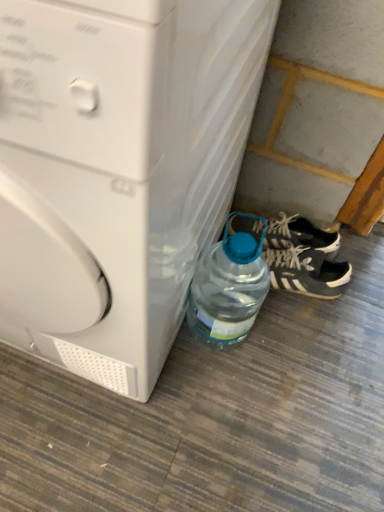
Question: From the image's perspective, is transparent plastic bottle at lower right located above white plastic washing machine at lower left?

Choices:
 (A) no
 (B) yes

Answer: (A)

Question: Is transparent plastic bottle at lower right to the left of white plastic washing machine at lower left from the viewer's perspective?

Choices:
 (A) no
 (B) yes

Answer: (A)

Question: Can you confirm if transparent plastic bottle at lower right is shorter than white plastic washing machine at lower left?

Choices:
 (A) no
 (B) yes

Answer: (B)

Question: Is transparent plastic bottle at lower right closer to the viewer compared to white plastic washing machine at lower left?

Choices:
 (A) no
 (B) yes

Answer: (A)

Question: Is transparent plastic bottle at lower right located outside white plastic washing machine at lower left?

Choices:
 (A) no
 (B) yes

Answer: (B)

Question: Relative to black suede sneakers at lower right, is transparent plastic bottle at lower right in front or behind?

Choices:
 (A) front
 (B) behind

Answer: (A)

Question: Is transparent plastic bottle at lower right bigger or smaller than black suede sneakers at lower right?

Choices:
 (A) small
 (B) big

Answer: (B)

Question: Is point (210, 289) positioned closer to the camera than point (291, 268)?

Choices:
 (A) closer
 (B) farther

Answer: (A)

Question: Is transparent plastic bottle at lower right wider or thinner than black suede sneakers at lower right?

Choices:
 (A) thin
 (B) wide

Answer: (A)

Question: From the image's perspective, is white plastic washing machine at lower left located above or below black matte sneakers at lower right?

Choices:
 (A) below
 (B) above

Answer: (B)

Question: In terms of width, does white plastic washing machine at lower left look wider or thinner when compared to black matte sneakers at lower right?

Choices:
 (A) thin
 (B) wide

Answer: (B)

Question: Is white plastic washing machine at lower left taller or shorter than black matte sneakers at lower right?

Choices:
 (A) tall
 (B) short

Answer: (A)

Question: From a real-world perspective, is white plastic washing machine at lower left above or below black matte sneakers at lower right?

Choices:
 (A) above
 (B) below

Answer: (A)

Question: From the image's perspective, relative to black matte sneakers at lower right, is black suede sneakers at lower right above or below?

Choices:
 (A) above
 (B) below

Answer: (B)

Question: Considering the positions of black suede sneakers at lower right and black matte sneakers at lower right in the image, is black suede sneakers at lower right wider or thinner than black matte sneakers at lower right?

Choices:
 (A) thin
 (B) wide

Answer: (B)